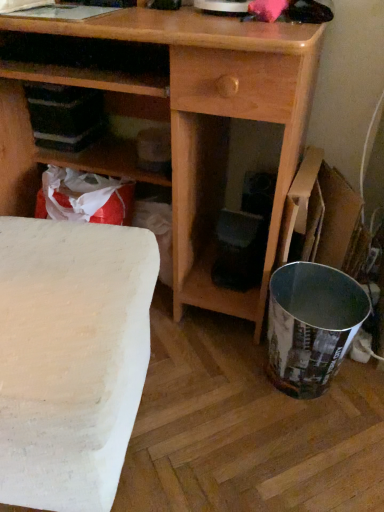
Where is `blank space situated above white matte table at lower left (from a real-world perspective)`? blank space situated above white matte table at lower left (from a real-world perspective) is located at coordinates (53, 275).